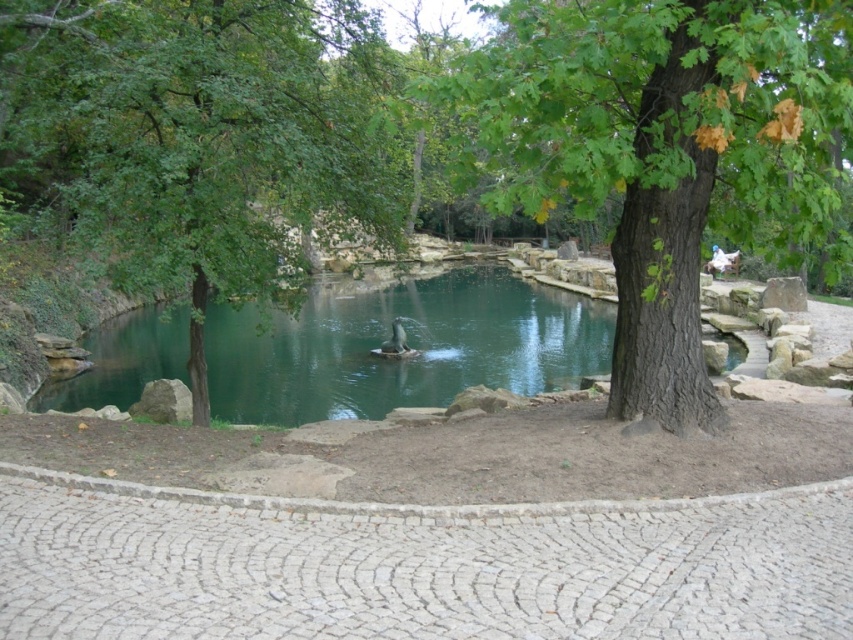
Question: Observing the image, what is the correct spatial positioning of green rough bark tree at center in reference to brown fuzzy duck at center?

Choices:
 (A) below
 (B) above

Answer: (B)

Question: Is green leafy tree at center wider than brown fuzzy duck at center?

Choices:
 (A) no
 (B) yes

Answer: (A)

Question: Based on their relative distances, which object is nearer to the brown fuzzy duck at center?

Choices:
 (A) green leafy tree at center
 (B) green rough bark tree at center
 (C) green smooth water at center

Answer: (C)

Question: Which point appears closest to the camera in this image?

Choices:
 (A) (399, 342)
 (B) (314, 44)
 (C) (445, 273)

Answer: (B)

Question: Among these points, which one is nearest to the camera?

Choices:
 (A) (312, 420)
 (B) (370, 349)
 (C) (51, 35)
 (D) (778, 125)

Answer: (D)

Question: In this image, where is green leafy tree at center located relative to brown fuzzy duck at center?

Choices:
 (A) left
 (B) right

Answer: (A)